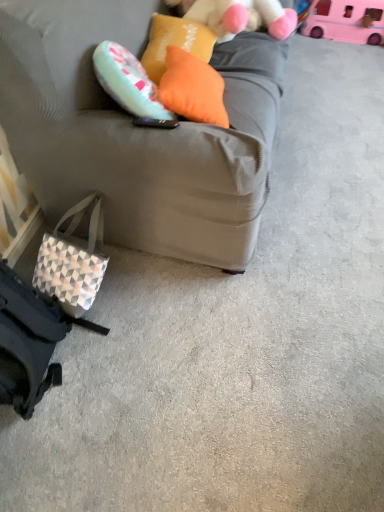
This screenshot has width=384, height=512. I want to click on free location in front of pink plastic toy at upper right, so click(x=336, y=57).